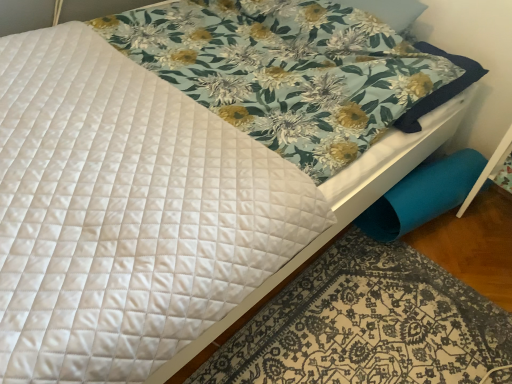
I want to click on free space underneath blue fabric at lower right (from a real-world perspective), so click(x=381, y=334).